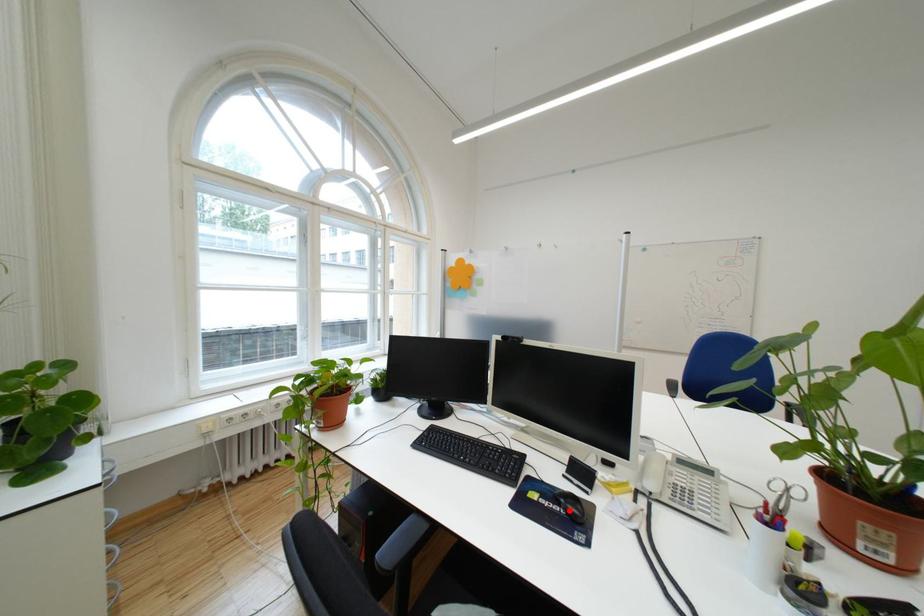
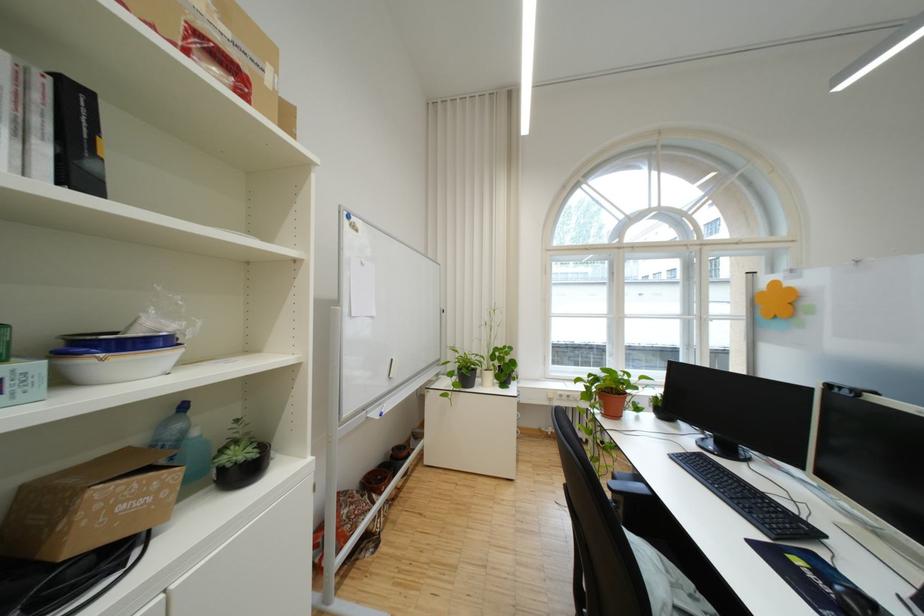
The point at the highlighted location is marked in the first image. Where is the corresponding point in the second image?

(841, 592)